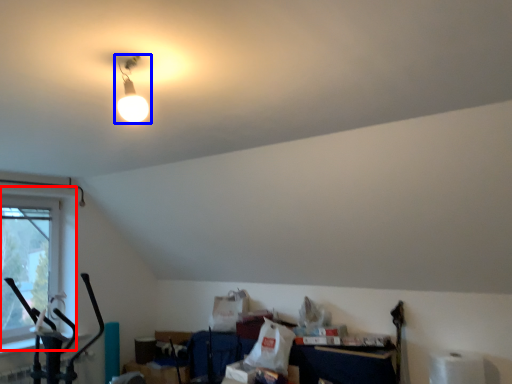
Question: Among these objects, which one is farthest to the camera, window (highlighted by a red box) or lamp (highlighted by a blue box)?

Choices:
 (A) window
 (B) lamp

Answer: (A)